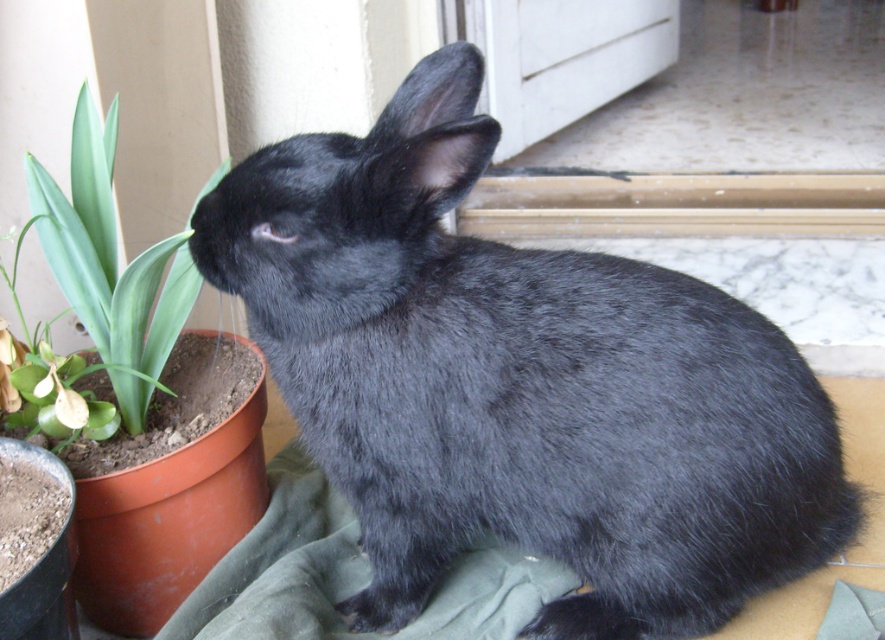
Question: Considering the relative positions of black fur rabbit at center and white matte screen door at upper center in the image provided, where is black fur rabbit at center located with respect to white matte screen door at upper center?

Choices:
 (A) left
 (B) right

Answer: (A)

Question: Is black fur rabbit at center thinner than green leafy plant at lower left?

Choices:
 (A) no
 (B) yes

Answer: (A)

Question: Which object appears closest to the camera in this image?

Choices:
 (A) white matte screen door at upper center
 (B) green leafy plant at lower left

Answer: (B)

Question: Considering the real-world distances, which object is farthest from the white matte screen door at upper center?

Choices:
 (A) green leafy plant at lower left
 (B) black fur rabbit at center

Answer: (B)

Question: Which object is the closest to the white matte screen door at upper center?

Choices:
 (A) green leafy plant at lower left
 (B) black fur rabbit at center

Answer: (A)

Question: Is black fur rabbit at center below green leafy plant at lower left?

Choices:
 (A) no
 (B) yes

Answer: (B)